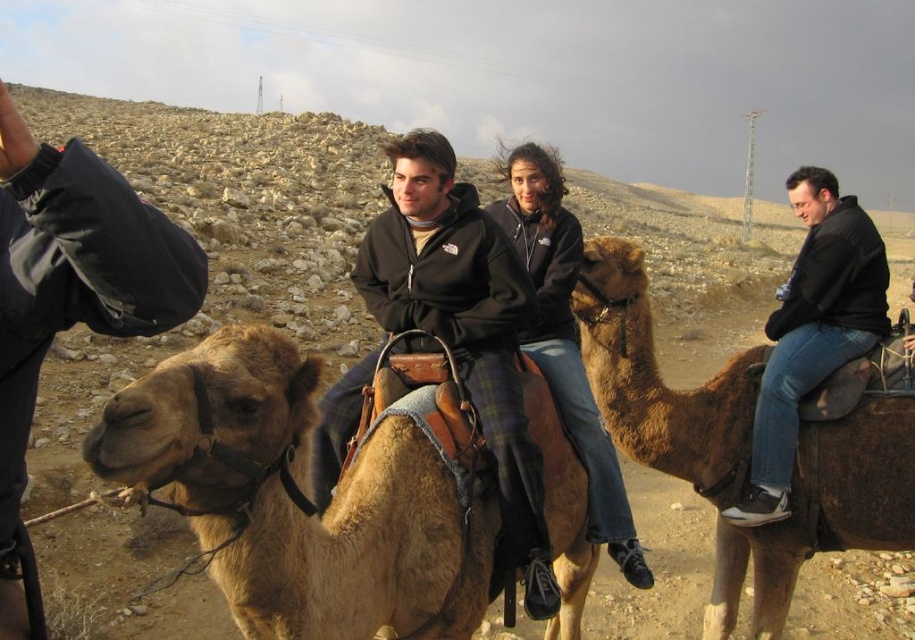
Measure the distance between point (911,477) and camera.

The distance of point (911,477) from camera is 11.44 feet.

Who is higher up, brown fuzzy camel at right or matte black jacket at upper left?

Positioned higher is matte black jacket at upper left.

What do you see at coordinates (659, 380) in the screenshot? I see `brown fuzzy camel at right` at bounding box center [659, 380].

The image size is (915, 640). Find the location of `brown fuzzy camel at right`. brown fuzzy camel at right is located at coordinates (659, 380).

Between light brown leather camel at center and brown fuzzy camel at right, which one has more height?

Standing taller between the two is brown fuzzy camel at right.

Is light brown leather camel at center smaller than brown fuzzy camel at right?

Yes.

Is point (201, 433) less distant than point (881, 445)?

Yes.

I want to click on light brown leather camel at center, so click(300, 497).

Is the position of light brown leather camel at center more distant than that of dark brown leather jacket at center?

No.

Can you confirm if light brown leather camel at center is smaller than dark brown leather jacket at center?

Yes, light brown leather camel at center is smaller than dark brown leather jacket at center.

Identify the location of light brown leather camel at center. The image size is (915, 640). (300, 497).

Locate an element on the screen. The image size is (915, 640). light brown leather camel at center is located at coordinates (300, 497).